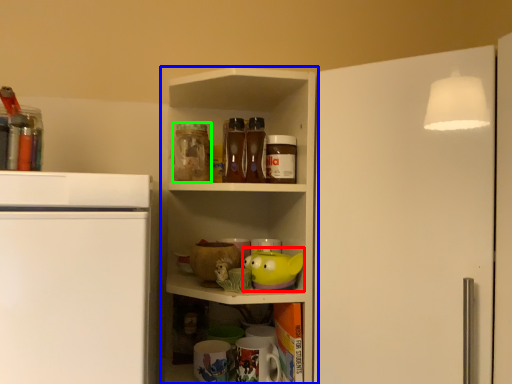
Question: Estimate the real-world distances between objects in this image. Which object is closer to toy (highlighted by a red box), shelf (highlighted by a blue box) or beverage (highlighted by a green box)?

Choices:
 (A) shelf
 (B) beverage

Answer: (B)